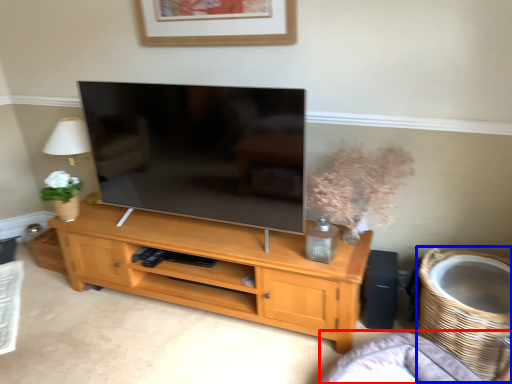
Question: Which point is further to the camera, couch (highlighted by a red box) or basket (highlighted by a blue box)?

Choices:
 (A) couch
 (B) basket

Answer: (B)